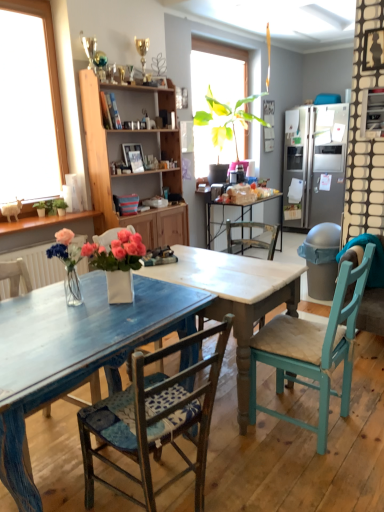
Question: Does point (155, 449) appear closer or farther from the camera than point (44, 328)?

Choices:
 (A) closer
 (B) farther

Answer: (B)

Question: In terms of size, does wooden chair with blue cushion at center, arranged as the 2th chair when viewed from the left, appear bigger or smaller than blue painted wood table at center?

Choices:
 (A) small
 (B) big

Answer: (A)

Question: Based on their relative distances, which object is farther from the wooden cabinet at center?

Choices:
 (A) white marble table at center
 (B) wooden chair with blue cushion at center, arranged as the 2th chair when viewed from the left
 (C) distressed blue chair at lower left, which appears as the 3th chair when viewed from the right
 (D) satin silver refrigerator at right
 (E) blue painted wood table at center

Answer: (D)

Question: Which object is the farthest from the white marble table at center?

Choices:
 (A) teal wood chair at right, the 3th chair from the left
 (B) blue painted wood table at center
 (C) wooden cabinet at center
 (D) distressed blue chair at lower left, which appears as the 3th chair when viewed from the right
 (E) wooden chair with blue cushion at center, the 2th chair when ordered from right to left

Answer: (C)